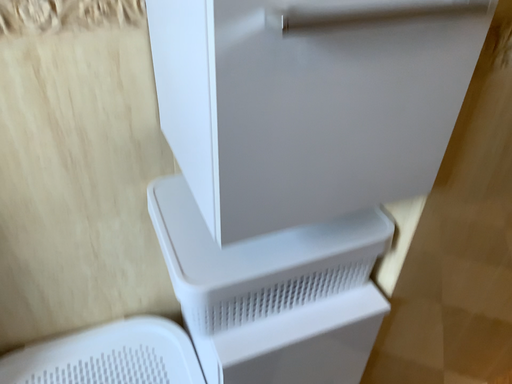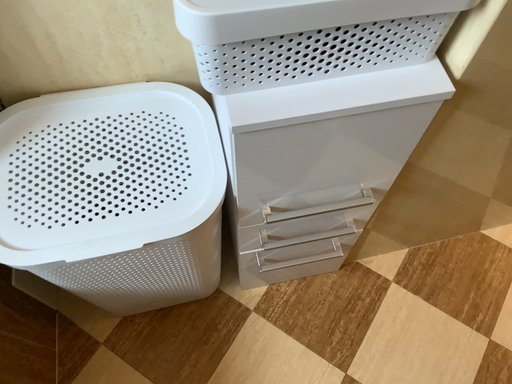
Question: How did the camera likely rotate when shooting the video?

Choices:
 (A) rotated upward
 (B) rotated downward

Answer: (B)